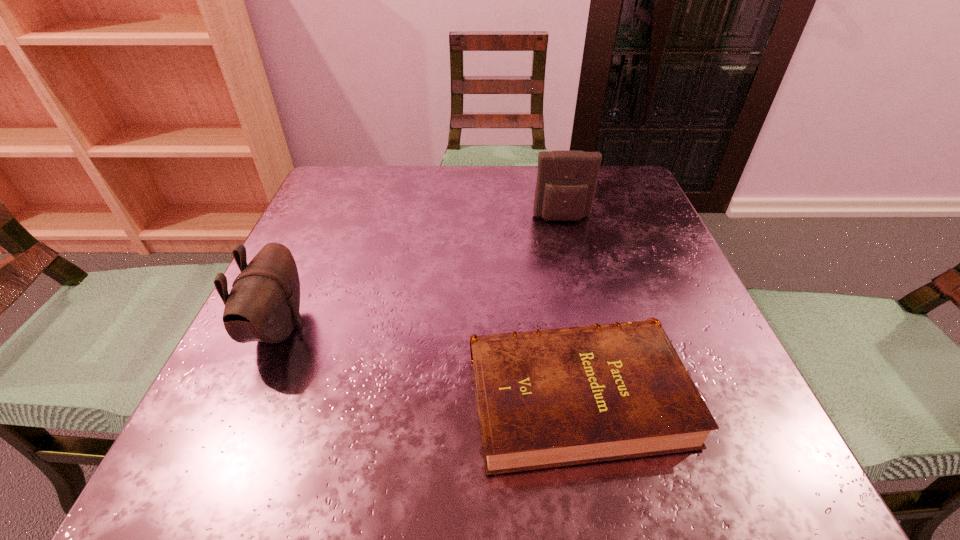
You are a GUI agent. You are given a task and a screenshot of the screen. Output one action in this format:
    pyautogui.click(x=<x>, y=<y>)
    Task: Click on the farthest object
    The width and height of the screenshot is (960, 540).
    Given the screenshot: What is the action you would take?
    pyautogui.click(x=566, y=180)

Locate an element on the screen. This screenshot has width=960, height=540. the right pouch is located at coordinates (x=566, y=180).

The image size is (960, 540). Find the location of `the left pouch`. the left pouch is located at coordinates [263, 305].

I want to click on the nearer pouch, so click(x=263, y=305).

This screenshot has height=540, width=960. Identify the location of hardback book. (547, 398).

You are a GUI agent. You are given a task and a screenshot of the screen. Output one action in this format:
    pyautogui.click(x=<x>, y=<y>)
    Task: Click on the vacant space situated with an open flap on the farther pouch
    The height and width of the screenshot is (540, 960).
    Given the screenshot: What is the action you would take?
    pyautogui.click(x=569, y=249)

You are a GUI agent. You are given a task and a screenshot of the screen. Output one action in this format:
    pyautogui.click(x=<x>, y=<y>)
    Task: Click on the free space located 0.350m with the flap open on the leftmost object
    
    Given the screenshot: What is the action you would take?
    pyautogui.click(x=521, y=327)

Where is `free space located 0.350m on the left of the shortest object`? This screenshot has height=540, width=960. free space located 0.350m on the left of the shortest object is located at coordinates (219, 396).

At what (x,y) coordinates should I click in order to perform the action: click on object at the far edge. Please return your answer as a coordinate pair (x, y). The height and width of the screenshot is (540, 960). Looking at the image, I should click on (566, 180).

I want to click on object that is at the near edge, so click(547, 398).